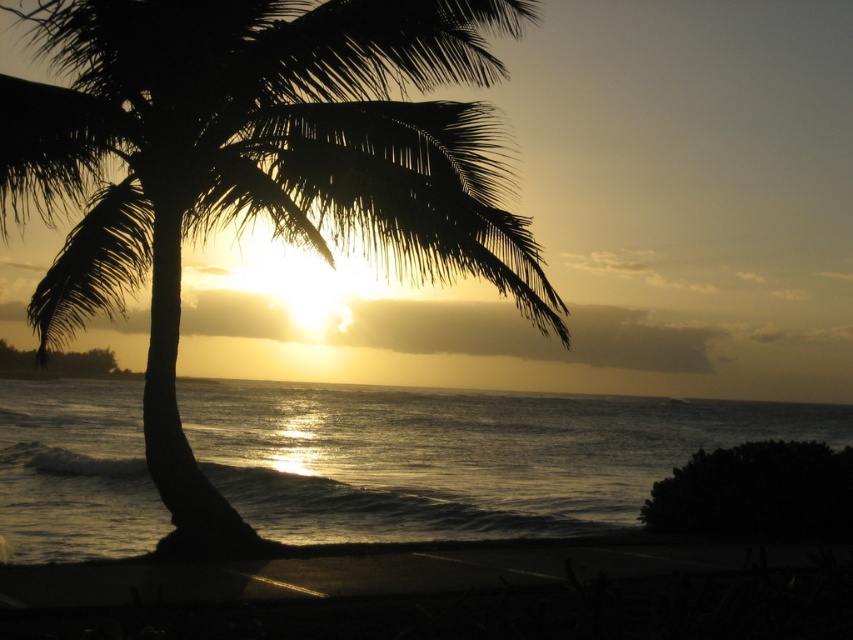
Question: Can you confirm if silhouette leafy palm at center is thinner than glistening silver water at center?

Choices:
 (A) yes
 (B) no

Answer: (A)

Question: Is silhouette leafy palm at center above glistening silver water at center?

Choices:
 (A) yes
 (B) no

Answer: (A)

Question: Which object is farther from the camera taking this photo?

Choices:
 (A) glistening silver water at center
 (B) silhouette leafy palm at center

Answer: (B)

Question: Is silhouette leafy palm at center bigger than glistening silver water at center?

Choices:
 (A) yes
 (B) no

Answer: (B)